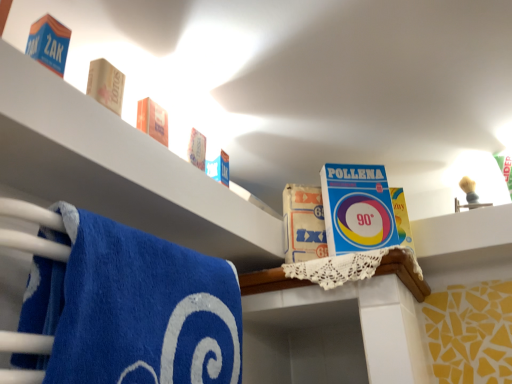
Question: Considering the relative sizes of blue cardboard box at upper left, which ranks as the first product in left-to-right order, and blue terry cloth towel at lower left in the image provided, is blue cardboard box at upper left, which ranks as the first product in left-to-right order, bigger than blue terry cloth towel at lower left?

Choices:
 (A) no
 (B) yes

Answer: (A)

Question: Is blue cardboard box at upper left, the 3th product from the bottom, not within blue terry cloth towel at lower left?

Choices:
 (A) no
 (B) yes

Answer: (B)

Question: Is blue cardboard box at upper left, placed as the third product when sorted from right to left, wider than blue terry cloth towel at lower left?

Choices:
 (A) no
 (B) yes

Answer: (A)

Question: Is blue cardboard box at upper left, the 3th product from the bottom, at the right side of blue terry cloth towel at lower left?

Choices:
 (A) no
 (B) yes

Answer: (A)

Question: Is blue cardboard box at upper left, marked as the first product in a top-to-bottom arrangement, positioned with its back to blue terry cloth towel at lower left?

Choices:
 (A) no
 (B) yes

Answer: (A)

Question: From the image's perspective, is blue cardboard box at upper left, which ranks as the first product in left-to-right order, beneath blue terry cloth towel at lower left?

Choices:
 (A) yes
 (B) no

Answer: (B)

Question: From the image's perspective, would you say blue cardboard box at upper left is positioned over blue cardboard box at upper left, the 3th product from the bottom?

Choices:
 (A) yes
 (B) no

Answer: (B)

Question: From a real-world perspective, is blue cardboard box at upper left under blue cardboard box at upper left, placed as the 1th product when sorted from front to back?

Choices:
 (A) no
 (B) yes

Answer: (B)

Question: Does blue cardboard box at upper left have a lesser width compared to blue cardboard box at upper left, placed as the third product when sorted from back to front?

Choices:
 (A) yes
 (B) no

Answer: (B)

Question: Considering the relative sizes of blue cardboard box at upper left and blue cardboard box at upper left, the 3th product from the bottom, in the image provided, is blue cardboard box at upper left wider than blue cardboard box at upper left, the 3th product from the bottom,?

Choices:
 (A) yes
 (B) no

Answer: (A)

Question: Can you confirm if blue cardboard box at upper left is positioned to the right of blue cardboard box at upper left, the 3th product from the bottom?

Choices:
 (A) yes
 (B) no

Answer: (A)

Question: Is blue cardboard box at upper left not inside blue cardboard box at upper left, which ranks as the first product in left-to-right order?

Choices:
 (A) no
 (B) yes

Answer: (B)

Question: Is wooden block at upper left, which ranks as the second product in right-to-left order, positioned beyond the bounds of blue cardboard box at upper left, placed as the third product when sorted from back to front?

Choices:
 (A) no
 (B) yes

Answer: (B)